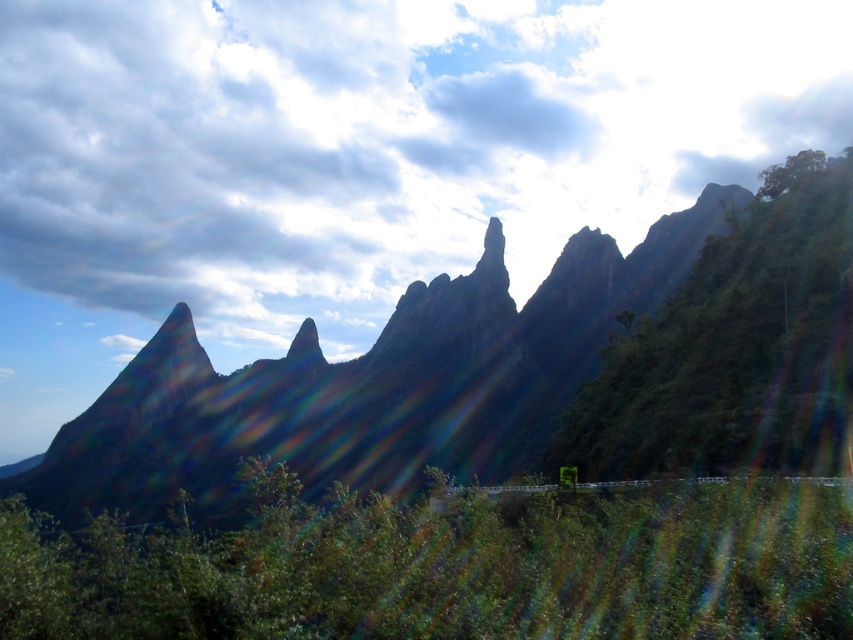
Looking at this image, which is more to the right, rugged rock formation at center or green leafy bush at lower center?

Positioned to the right is green leafy bush at lower center.

Is rugged rock formation at center to the right of green leafy bush at lower center from the viewer's perspective?

Incorrect, rugged rock formation at center is not on the right side of green leafy bush at lower center.

Does point (549, 419) come farther from viewer compared to point (572, 506)?

That is True.

Where is `rugged rock formation at center`? The width and height of the screenshot is (853, 640). rugged rock formation at center is located at coordinates (514, 369).

Between white fluffy cloud at upper center and rugged rock formation at center, which one is positioned higher?

Positioned higher is white fluffy cloud at upper center.

Does white fluffy cloud at upper center have a greater width compared to rugged rock formation at center?

Indeed, white fluffy cloud at upper center has a greater width compared to rugged rock formation at center.

Identify the location of white fluffy cloud at upper center. pyautogui.click(x=367, y=148).

What are the coordinates of `white fluffy cloud at upper center` in the screenshot? It's located at tap(367, 148).

At what (x,y) coordinates should I click in order to perform the action: click on white fluffy cloud at upper center. Please return your answer as a coordinate pair (x, y). The width and height of the screenshot is (853, 640). Looking at the image, I should click on (367, 148).

Is white fluffy cloud at upper center below green leafy bush at lower center?

Actually, white fluffy cloud at upper center is above green leafy bush at lower center.

Where is `white fluffy cloud at upper center`? This screenshot has height=640, width=853. white fluffy cloud at upper center is located at coordinates (367, 148).